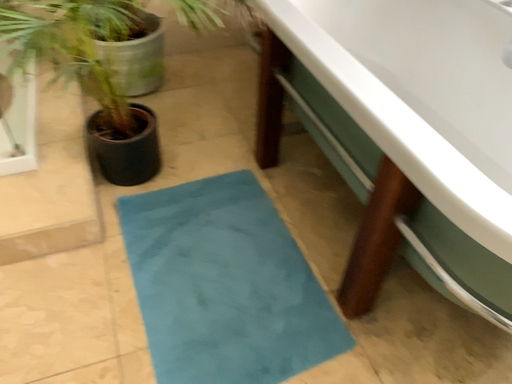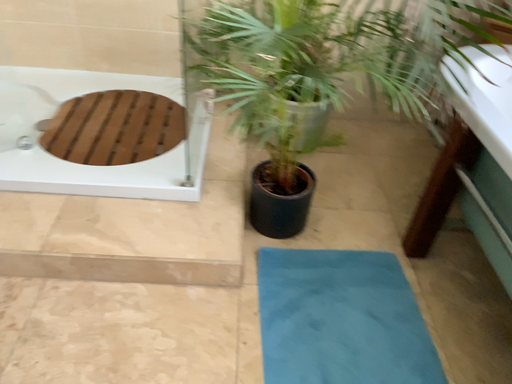
Question: Which way did the camera rotate in the video?

Choices:
 (A) rotated left
 (B) rotated right

Answer: (A)